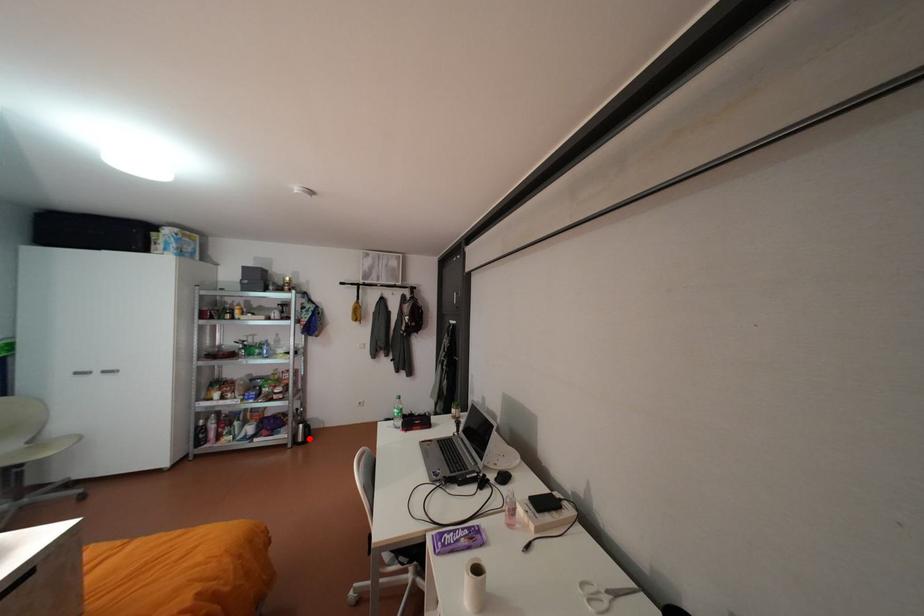
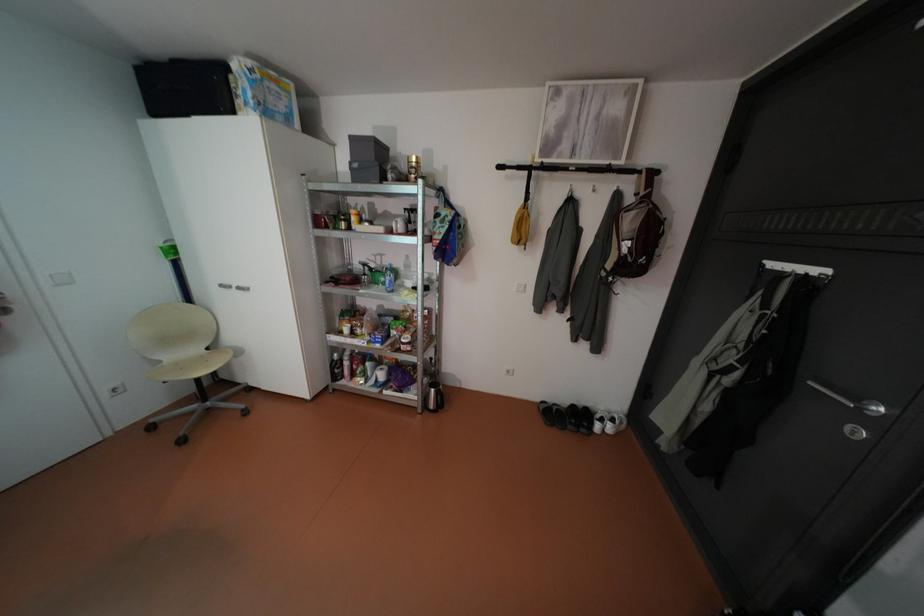
The point at the highlighted location is marked in the first image. Where is the corresponding point in the second image?

(441, 405)